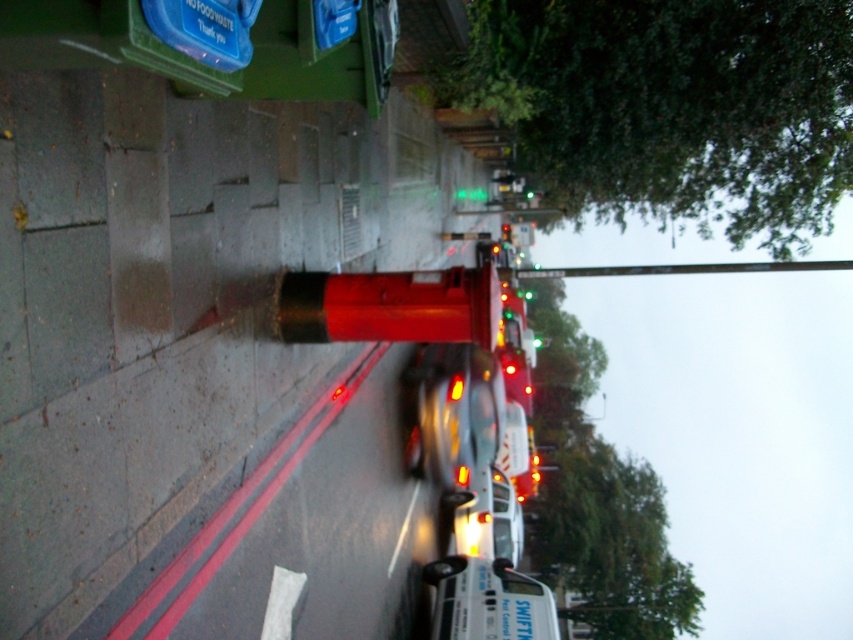
Question: Is white glossy car at center thinner than green glass traffic light at center?

Choices:
 (A) no
 (B) yes

Answer: (A)

Question: Which is farther from the shiny silver car at center?

Choices:
 (A) white glossy van at center
 (B) green glass traffic light at center
 (C) white glossy car at center

Answer: (B)

Question: In this image, where is white glossy car at center located relative to green glass traffic light at center?

Choices:
 (A) below
 (B) above

Answer: (A)

Question: Is shiny silver car at center wider than white glossy car at center?

Choices:
 (A) no
 (B) yes

Answer: (B)

Question: Which of the following is the farthest from the observer?

Choices:
 (A) (469, 600)
 (B) (506, 227)

Answer: (B)

Question: Which point appears closest to the camera in this image?

Choices:
 (A) (506, 221)
 (B) (451, 538)

Answer: (B)